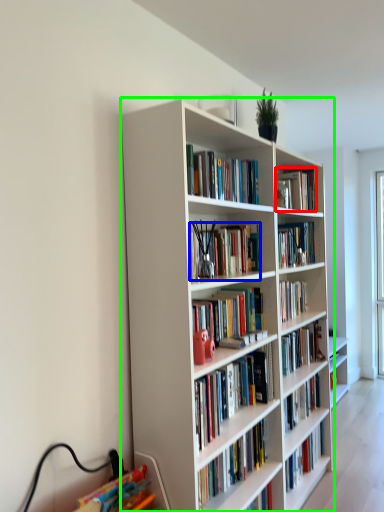
Question: Estimate the real-world distances between objects in this image. Which object is closer to book (highlighted by a red box), book (highlighted by a blue box) or bookcase (highlighted by a green box)?

Choices:
 (A) book
 (B) bookcase

Answer: (A)